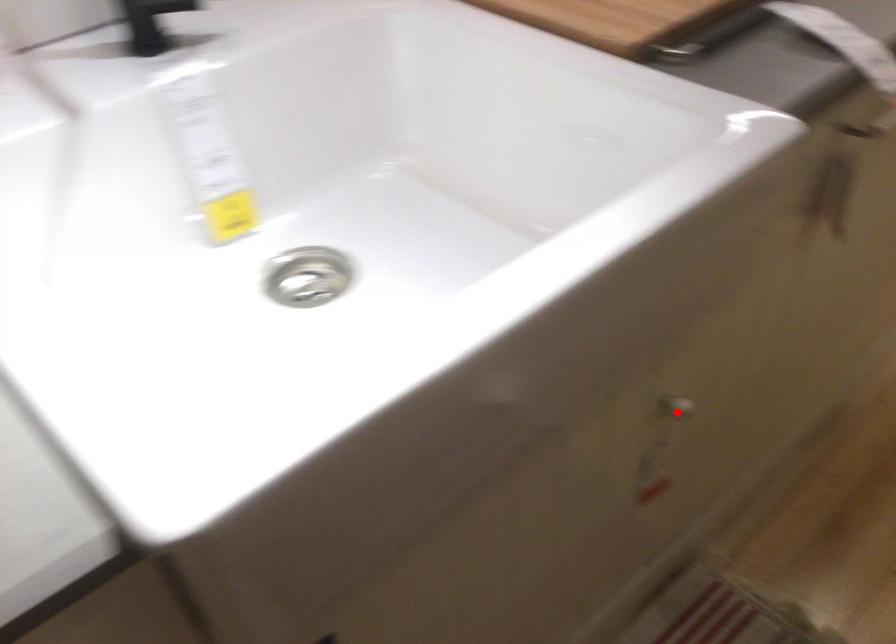
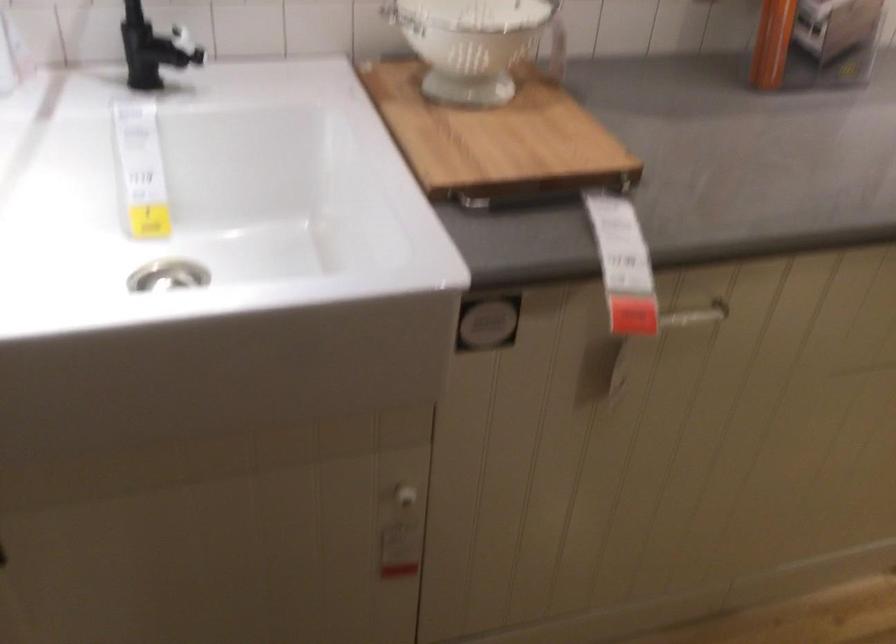
Question: I am providing you with two images of the same scene from different viewpoints. In image1, a red point is highlighted. Considering the same 3D point in image2, which of the following is correct?

Choices:
 (A) It is closer
 (B) It is farther

Answer: (B)